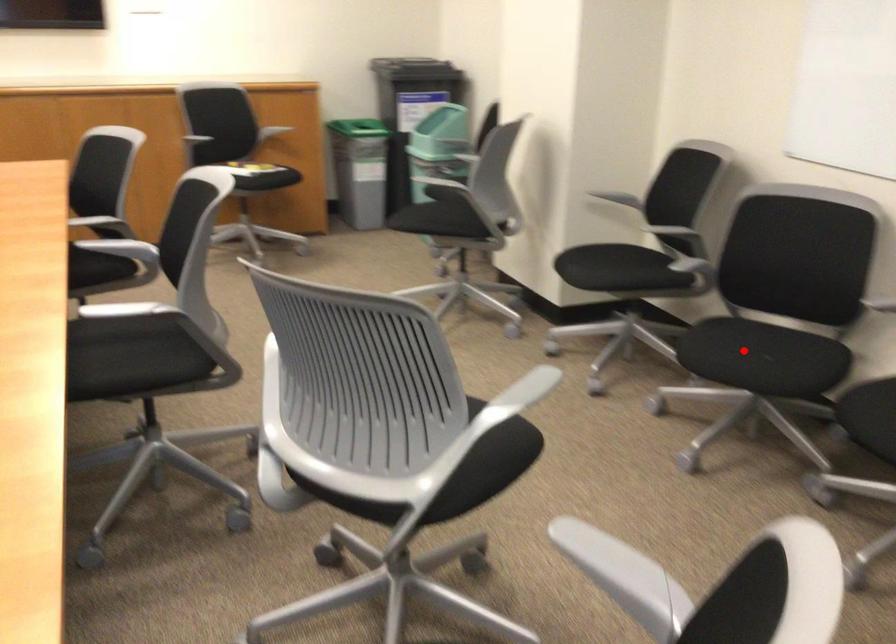
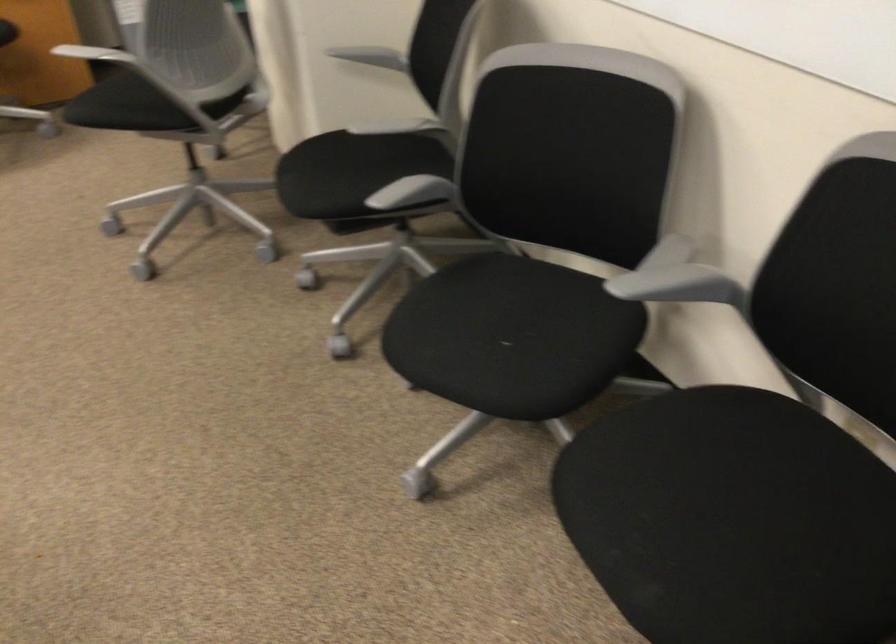
Question: I am providing you with two images of the same scene from different viewpoints. In image1, a red point is highlighted. Considering the same 3D point in image2, which of the following is correct?

Choices:
 (A) It is closer
 (B) It is farther

Answer: (A)